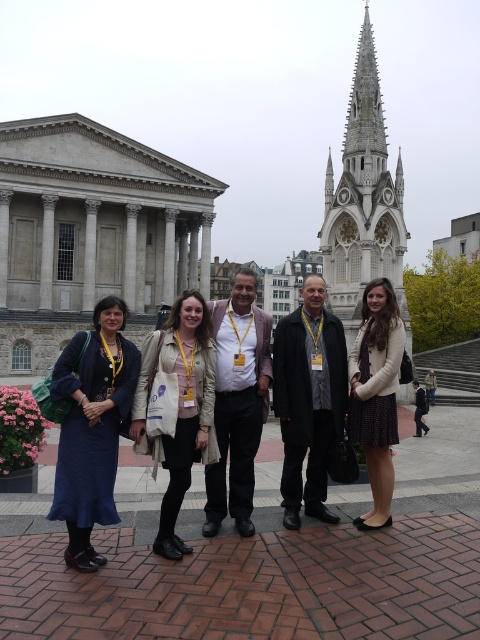
Question: Which point appears closest to the camera in this image?

Choices:
 (A) (385, 308)
 (B) (180, 403)
 (C) (252, 353)
 (D) (111, 340)

Answer: (B)

Question: Considering the real-world distances, which object is farthest from the black wool coat at center?

Choices:
 (A) light brown leather jacket at center
 (B) matte beige coat at center
 (C) matte blue skirt at left

Answer: (C)

Question: Is light brown leather jacket at center positioned at the back of matte beige coat at center?

Choices:
 (A) no
 (B) yes

Answer: (B)

Question: Observing the image, what is the correct spatial positioning of matte blue skirt at left in reference to light brown leather jacket at center?

Choices:
 (A) left
 (B) right

Answer: (A)

Question: Is black wool coat at center below matte white coat at center?

Choices:
 (A) yes
 (B) no

Answer: (B)

Question: Based on their relative distances, which object is farther from the matte blue skirt at left?

Choices:
 (A) matte white coat at center
 (B) light brown leather jacket at center
 (C) black wool coat at center
 (D) matte beige coat at center

Answer: (A)